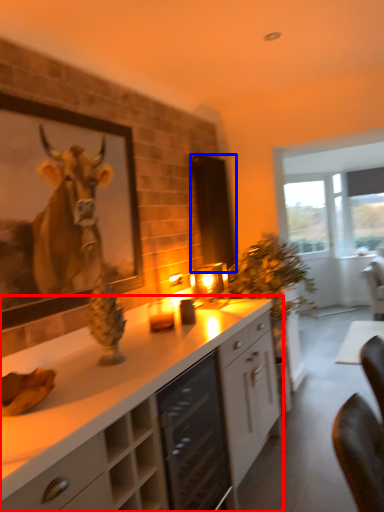
Question: Which object appears closest to the camera in this image, cabinetry (highlighted by a red box) or screen door (highlighted by a blue box)?

Choices:
 (A) cabinetry
 (B) screen door

Answer: (A)